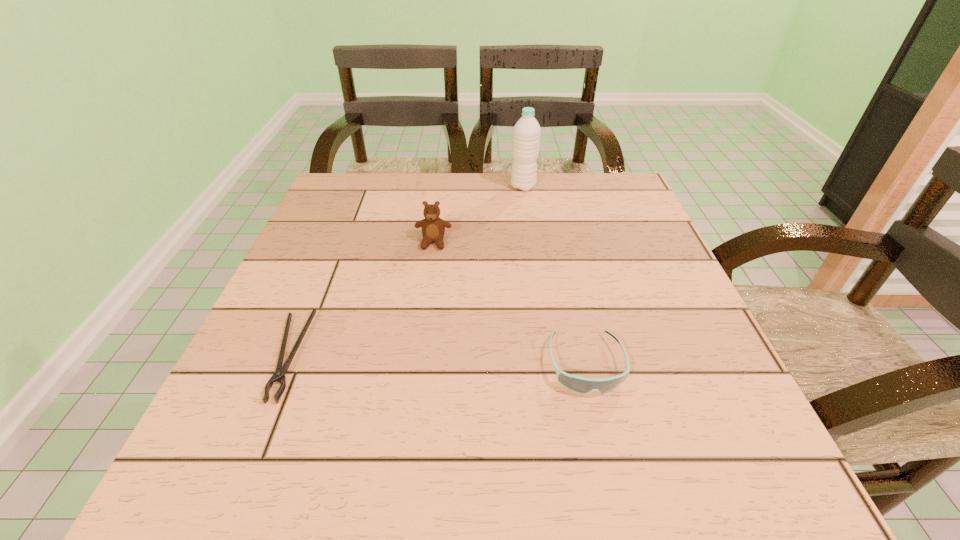
Locate an element on the screen. object that can be found as the third closest to the third object from right to left is located at coordinates (581, 385).

Image resolution: width=960 pixels, height=540 pixels. Identify the location of vacant space that satisfies the following two spatial constraints: 1. on the back side of the tallest object; 2. on the left side of the tongs. (357, 186).